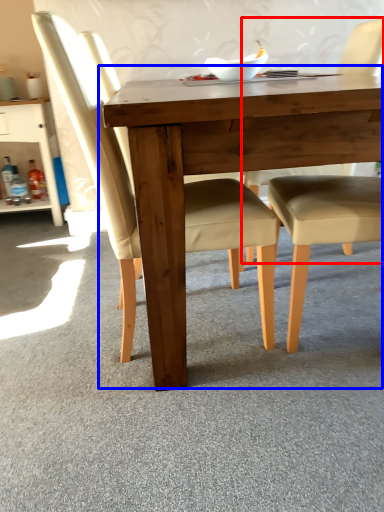
Question: Which object is further to the camera taking this photo, chair (highlighted by a red box) or table (highlighted by a blue box)?

Choices:
 (A) chair
 (B) table

Answer: (A)